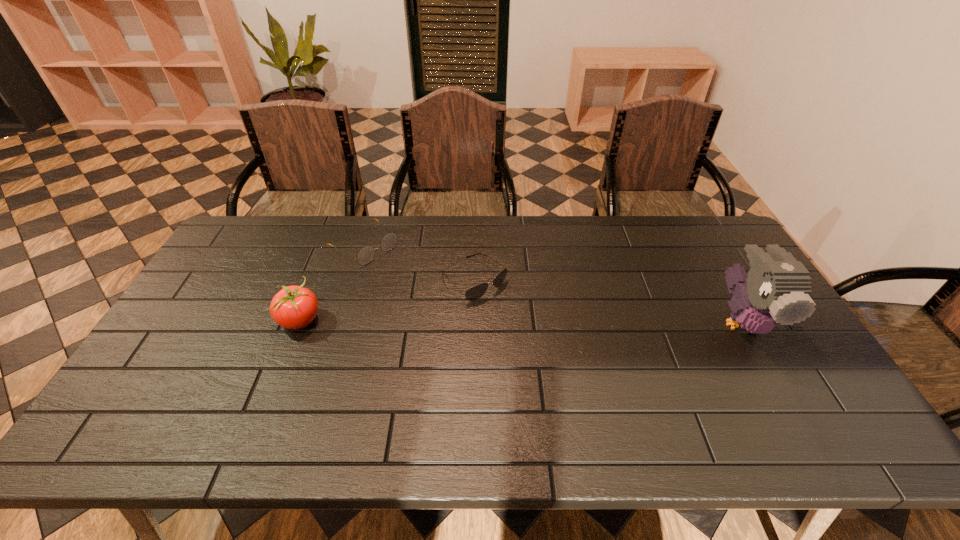
At what (x,y) coordinates should I click in order to perform the action: click on object that is the closest one to the tomato. Please return your answer as a coordinate pair (x, y). Looking at the image, I should click on (366, 254).

Identify which object is the nearest to the sunglasses. Please provide its 2D coordinates. Your answer should be formatted as a tuple, i.e. [(x, y)], where the tuple contains the x and y coordinates of a point satisfying the conditions above.

[(366, 254)]

Locate an element on the screen. The height and width of the screenshot is (540, 960). vacant space that satisfies the following two spatial constraints: 1. on the front side of the sunglasses; 2. on the right side of the spectacles is located at coordinates (353, 280).